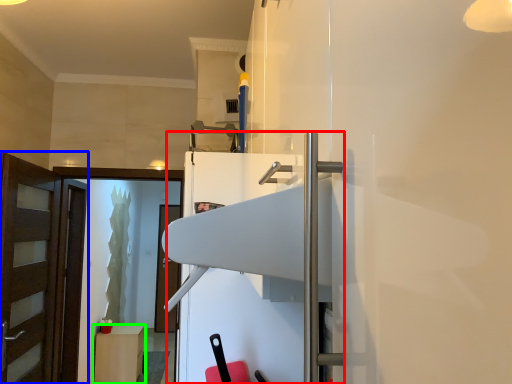
Question: Estimate the real-world distances between objects in this image. Which object is closer to fridge (highlighted by a red box), door (highlighted by a blue box) or cabinetry (highlighted by a green box)?

Choices:
 (A) door
 (B) cabinetry

Answer: (A)